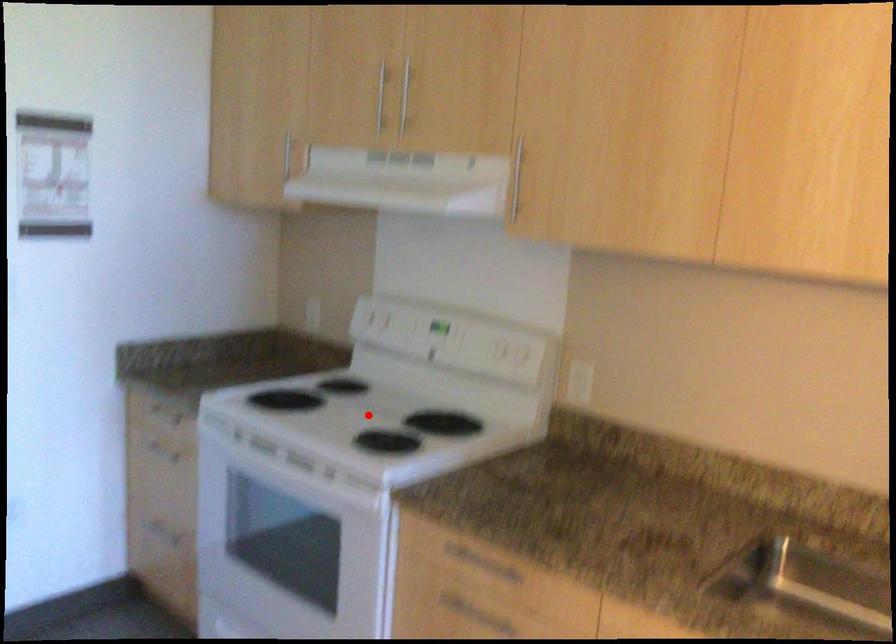
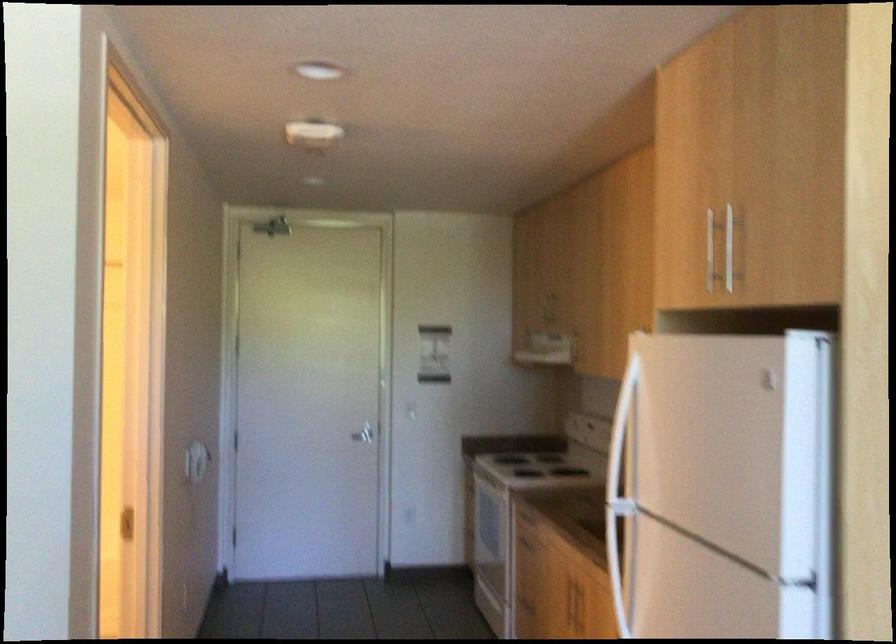
Question: I am providing you with two images of the same scene from different viewpoints. A red point is marked on the first image. Is the red point's position out of view in image 2?

Choices:
 (A) Yes
 (B) No

Answer: (A)